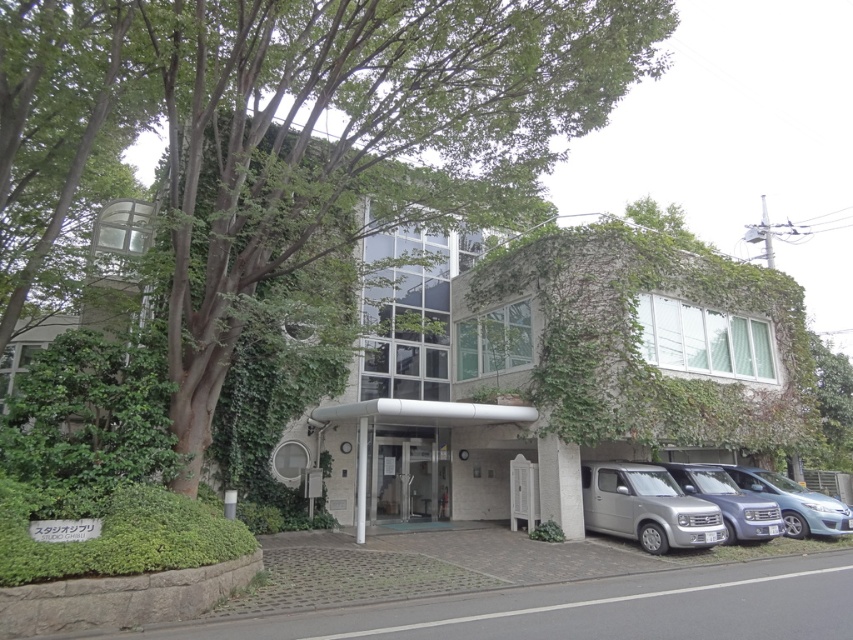
Does metallic silver van at lower right have a greater height compared to satin blue van at lower right?

Yes.

Who is more distant from viewer, [738,516] or [799,500]?

Positioned behind is point [799,500].

Between point (712, 477) and point (793, 502), which one is positioned behind?

Point (712, 477)

The height and width of the screenshot is (640, 853). In order to click on metallic silver van at lower right in this screenshot , I will do `click(729, 500)`.

Does green leafy tree at center have a lesser height compared to silver metallic van at lower right?

In fact, green leafy tree at center may be taller than silver metallic van at lower right.

Is point (589, 8) less distant than point (635, 515)?

Yes, it is in front of point (635, 515).

Find the location of a particular element. The height and width of the screenshot is (640, 853). green leafy tree at center is located at coordinates (358, 138).

Can you confirm if silver metallic van at lower right is wider than satin blue van at lower right?

In fact, silver metallic van at lower right might be narrower than satin blue van at lower right.

Is silver metallic van at lower right thinner than satin blue van at lower right?

Yes.

Between point (680, 522) and point (744, 474), which one is positioned behind?

Positioned behind is point (744, 474).

Where is `silver metallic van at lower right`? The height and width of the screenshot is (640, 853). silver metallic van at lower right is located at coordinates (646, 508).